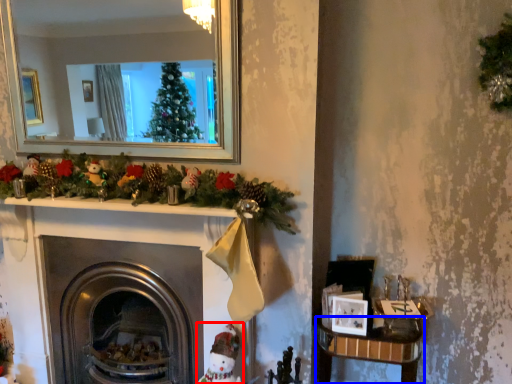
Question: Which point is closer to the camera, toy (highlighted by a red box) or table (highlighted by a blue box)?

Choices:
 (A) toy
 (B) table

Answer: (A)